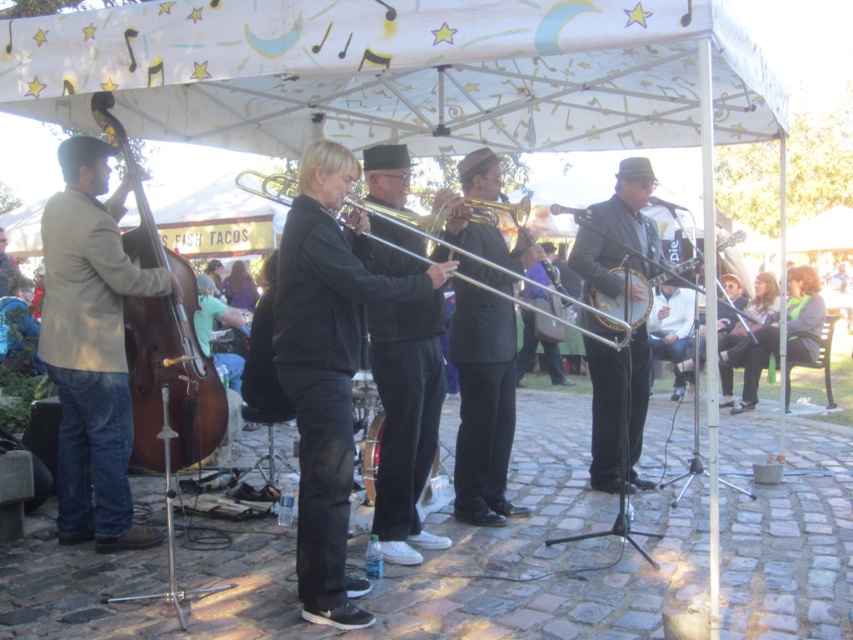
You are a photographer standing at the point marked by the coordinate [405,419] in the image. Which object are you directly facing? Please answer with the object label from the Objects list.

The point [405,419] is on the black matte trombone at center, so you are directly facing the black matte trombone at center.

You are a stagehand setting up microphones for the two trombones. The black matte trombone at center and the silver metallic trombone at center. Which one requires a larger microphone stand due to its size?

The black matte trombone at center is bigger than the silver metallic trombone at center, so it requires a larger microphone stand.

You are a photographer at the event and want to capture a closeup of the black matte trombone at center. Given that your camera can focus on objects within 3 meters, will you need to move closer to get a clear shot?

The black matte trombone at center is 4.03 meters away from camera. Since the camera can only focus within 3 meters, you need to move closer to ensure the black matte trombone at center is within the focus range.